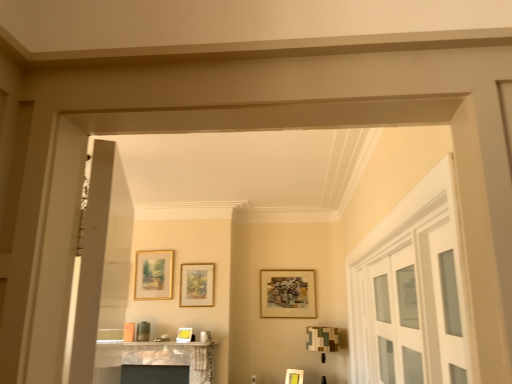
Question: Is matte gold picture frame at center, the 1th picture frame in the right-to-left sequence, shorter than matte gold picture frame at center, the third picture frame from the right?

Choices:
 (A) yes
 (B) no

Answer: (A)

Question: From a real-world perspective, is matte gold picture frame at center, which ranks as the fifth picture frame in left-to-right order, on top of matte gold picture frame at center, the third picture frame from the right?

Choices:
 (A) no
 (B) yes

Answer: (A)

Question: Can you confirm if matte gold picture frame at center, the 1th picture frame in the right-to-left sequence, is wider than matte gold picture frame at center, the third picture frame from the right?

Choices:
 (A) no
 (B) yes

Answer: (B)

Question: Considering the relative positions of matte gold picture frame at center, the 1th picture frame in the right-to-left sequence, and matte gold picture frame at center, placed as the 3th picture frame when sorted from left to right, in the image provided, is matte gold picture frame at center, the 1th picture frame in the right-to-left sequence, behind matte gold picture frame at center, placed as the 3th picture frame when sorted from left to right,?

Choices:
 (A) no
 (B) yes

Answer: (A)

Question: Considering the relative sizes of matte gold picture frame at center, which ranks as the fifth picture frame in left-to-right order, and matte gold picture frame at center, placed as the 3th picture frame when sorted from left to right, in the image provided, is matte gold picture frame at center, which ranks as the fifth picture frame in left-to-right order, bigger than matte gold picture frame at center, placed as the 3th picture frame when sorted from left to right,?

Choices:
 (A) yes
 (B) no

Answer: (A)

Question: Considering the positions of point (403, 367) and point (293, 377), is point (403, 367) closer or farther from the camera than point (293, 377)?

Choices:
 (A) closer
 (B) farther

Answer: (A)

Question: In the image, is clear glass cabinet at right positioned in front of or behind matte gold picture frame at center, the 1th picture frame in the right-to-left sequence?

Choices:
 (A) front
 (B) behind

Answer: (A)

Question: In the image, is clear glass cabinet at right on the left side or the right side of matte gold picture frame at center, which ranks as the fifth picture frame in left-to-right order?

Choices:
 (A) right
 (B) left

Answer: (A)

Question: Is clear glass cabinet at right wider or thinner than matte gold picture frame at center, which ranks as the fifth picture frame in left-to-right order?

Choices:
 (A) thin
 (B) wide

Answer: (A)

Question: Considering the positions of matte gold picture frame at center, placed as the 3th picture frame when sorted from left to right, and matte gold picture frame at upper left, the 1th picture frame positioned from the left, in the image, is matte gold picture frame at center, placed as the 3th picture frame when sorted from left to right, wider or thinner than matte gold picture frame at upper left, the 1th picture frame positioned from the left,?

Choices:
 (A) thin
 (B) wide

Answer: (A)

Question: From a real-world perspective, is matte gold picture frame at center, the third picture frame from the right, above or below matte gold picture frame at upper left, the 1th picture frame positioned from the left?

Choices:
 (A) above
 (B) below

Answer: (B)

Question: Do you think matte gold picture frame at center, placed as the 3th picture frame when sorted from left to right, is within matte gold picture frame at upper left, the 1th picture frame positioned from the left, or outside of it?

Choices:
 (A) inside
 (B) outside

Answer: (B)

Question: From the image's perspective, is matte gold picture frame at center, placed as the 3th picture frame when sorted from left to right, above or below matte gold picture frame at upper left, which is counted as the 5th picture frame, starting from the right?

Choices:
 (A) above
 (B) below

Answer: (B)

Question: Does point (413, 249) appear closer or farther from the camera than point (272, 283)?

Choices:
 (A) farther
 (B) closer

Answer: (B)

Question: From a real-world perspective, is clear glass cabinet at right physically located above or below wooden picture frame at center, the second picture frame from the right?

Choices:
 (A) below
 (B) above

Answer: (A)